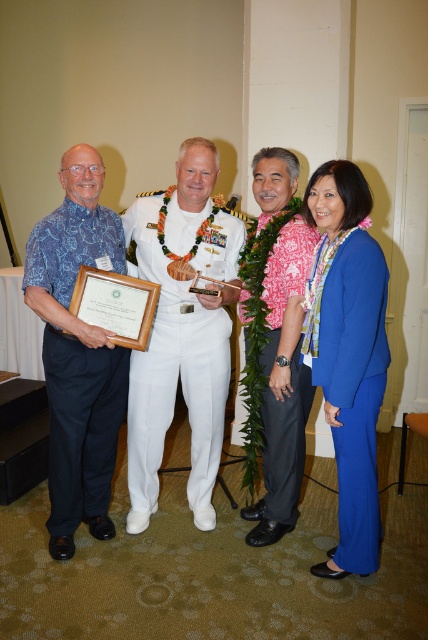
Looking at this image, based on the scene description and the objects provided, where is the matte blue suit at center located in terms of its 2D coordinates?

The matte blue suit at center is located at the 2D coordinates point (350, 355).